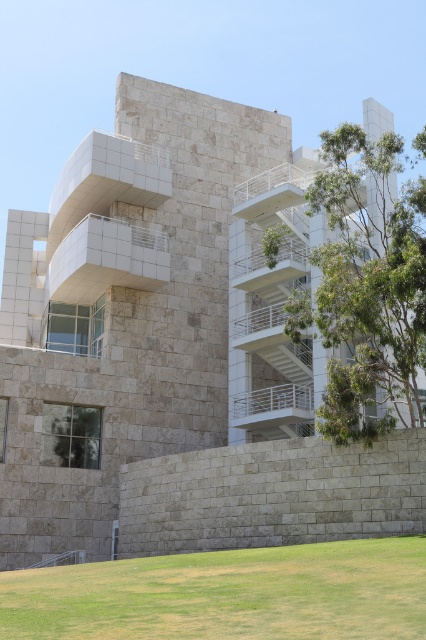
You are standing at the point marked as point (227, 595) in the image. What is the immediate surface beneath your feet?

The point (227, 595) is on green grass at lower center, so the immediate surface beneath your feet is green grass.

You are a visitor standing at the entrance of the museum. You see the green grass at lower center and the green leafy tree at right. Which object is taller?

The green leafy tree at right is taller than the green grass at lower center.

You are standing at the entrance of the modern museum and see two points marked on the facade. The first point is at coordinates point (149, 573) and the second is at point (333, 387). Which point is closer to you as you face the building?

Point (149, 573) is in front of point (333, 387), so the first point is closer to you as you face the building.